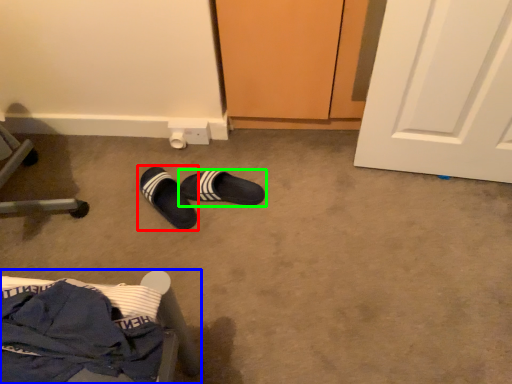
Question: Which is farther away from footwear (highlighted by a red box)? furniture (highlighted by a blue box) or footwear (highlighted by a green box)?

Choices:
 (A) furniture
 (B) footwear

Answer: (A)